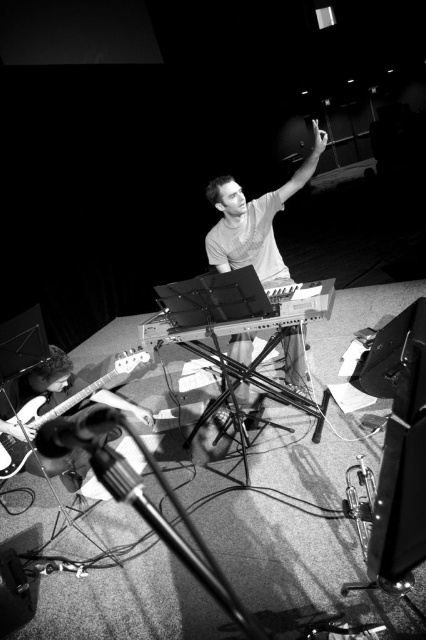
You are a photographer adjusting the lighting in the studio. You need to ensure that the matte gray shirt at center and the metallic electric guitar at lower left are both well lit. Since the shirt is narrower than the guitar, which object requires a smaller spotlight to cover it adequately?

The matte gray shirt at center requires a smaller spotlight because its width is less than the metallic electric guitar at lower left.

You are a photographer in the studio. You need to adjust the lighting so that the matte gray shirt at center and the metallic electric guitar at lower left are both well lit. Which object should you focus the light on first if you want to ensure the one closer to the camera is properly illuminated?

The matte gray shirt at center is located above the metallic electric guitar at lower left, so it is closer to the camera. Therefore, you should focus the light on the matte gray shirt at center first to ensure proper illumination.